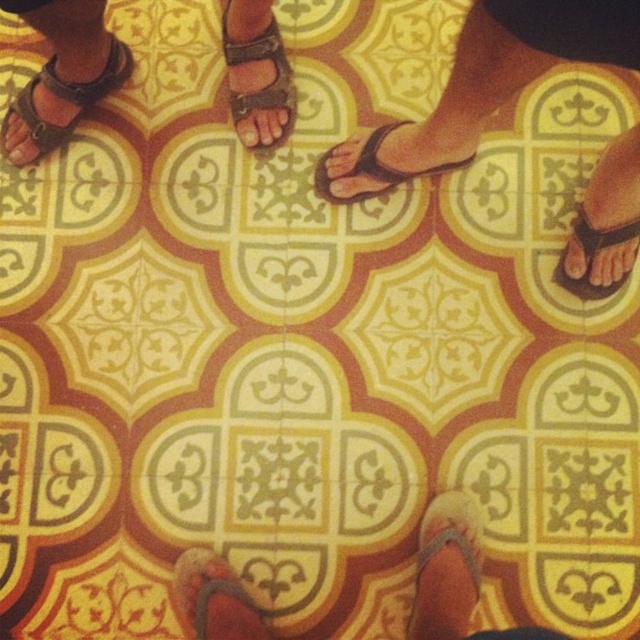
Question: Which point is closer to the camera?

Choices:
 (A) (326, 154)
 (B) (83, 100)

Answer: (B)

Question: Which point is closer to the camera?

Choices:
 (A) brown suede sandal at lower center
 (B) black rubber sandals at center

Answer: (B)

Question: Does black rubber flip-flop at right have a lesser width compared to matte brown sandal at upper left?

Choices:
 (A) no
 (B) yes

Answer: (B)

Question: Which is farther from the brown leather sandal at center?

Choices:
 (A) black rubber sandal at center
 (B) matte brown sandal at upper left
 (C) black rubber sandals at center
 (D) black rubber flip-flop at right

Answer: (D)

Question: Does black rubber sandals at center have a larger size compared to brown suede sandal at lower center?

Choices:
 (A) no
 (B) yes

Answer: (B)

Question: Does black rubber sandals at center have a larger size compared to black rubber flip-flop at right?

Choices:
 (A) yes
 (B) no

Answer: (A)